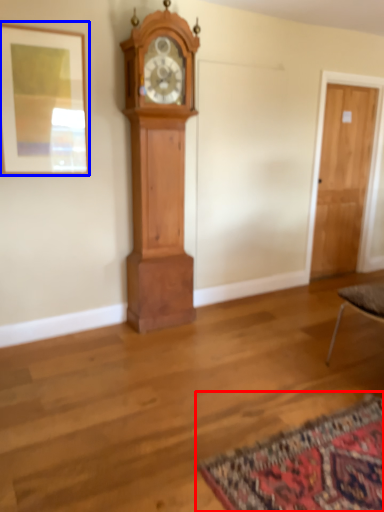
Question: Which point is further to the camera, mat (highlighted by a red box) or picture frame (highlighted by a blue box)?

Choices:
 (A) mat
 (B) picture frame

Answer: (B)